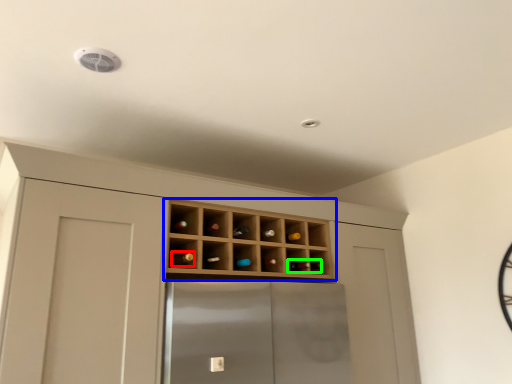
Question: Based on their relative distances, which object is nearer to wine bottle (highlighted by a red box)? Choose from shelf (highlighted by a blue box) and wine bottle (highlighted by a green box).

Choices:
 (A) shelf
 (B) wine bottle

Answer: (A)